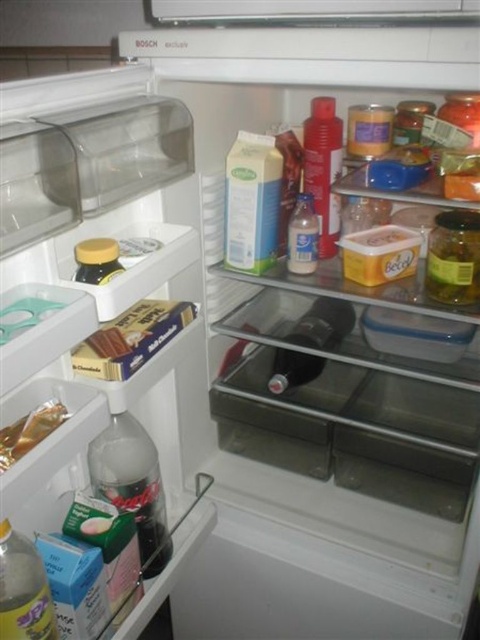
Question: Which point is farther from the camera taking this photo?

Choices:
 (A) (110, 428)
 (B) (83, 264)

Answer: (A)

Question: Does clear plastic bottle at lower left have a greater width compared to translucent plastic bottle at center?

Choices:
 (A) yes
 (B) no

Answer: (A)

Question: Which point is closer to the camera?

Choices:
 (A) (444, 260)
 (B) (351, 326)
 (C) (91, 253)
 (D) (47, 422)

Answer: (D)

Question: Is translucent plastic bottle at lower left to the left of gold foil packet at lower left from the viewer's perspective?

Choices:
 (A) no
 (B) yes

Answer: (A)

Question: Among these objects, which one is farthest from the camera?

Choices:
 (A) black matte bottle at center
 (B) translucent plastic bottle at center
 (C) gold foil packet at lower left

Answer: (A)

Question: Is matte plastic bottle at center positioned in front of gold foil packet at lower left?

Choices:
 (A) yes
 (B) no

Answer: (B)